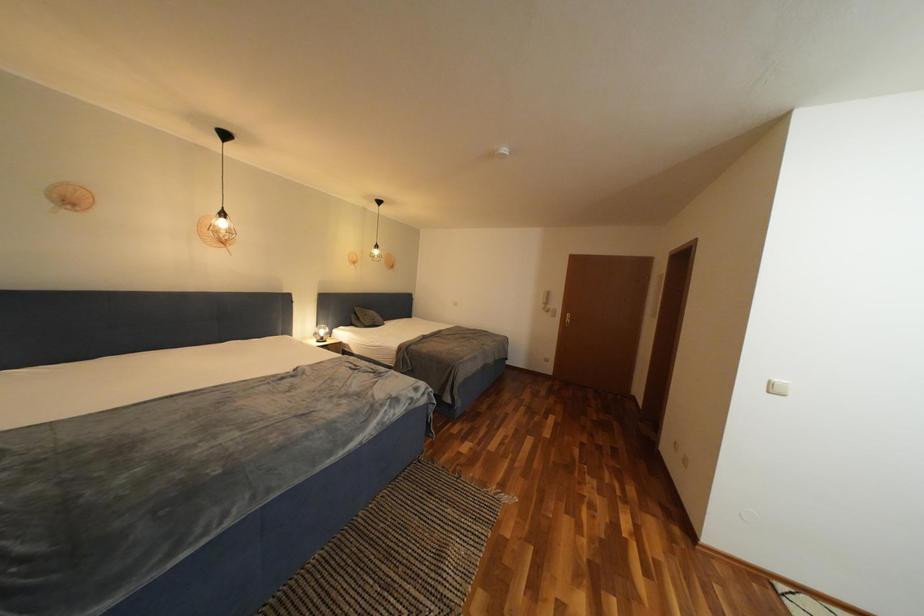
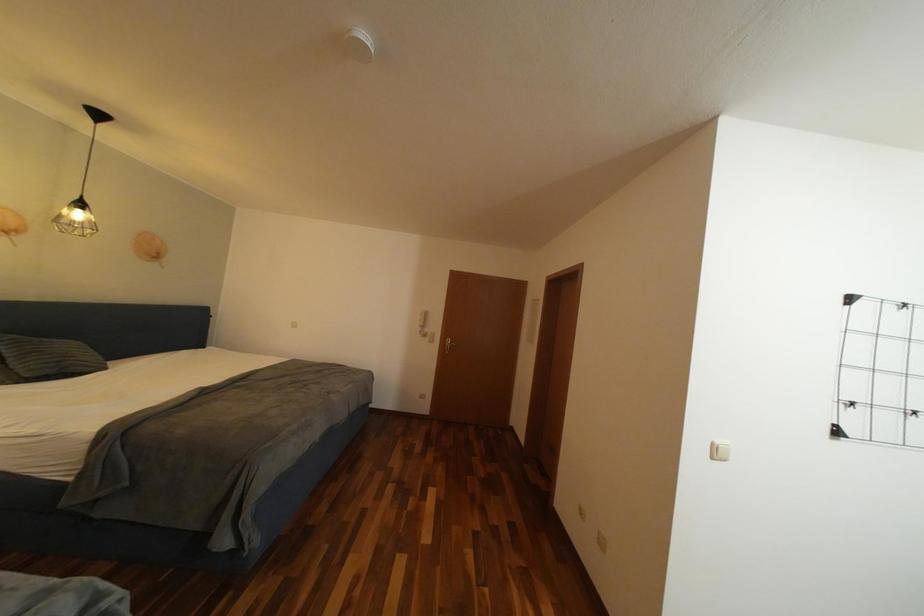
Question: Based on the continuous images, in which direction is the camera rotating? Reply with the corresponding letter.

Choices:
 (A) Left
 (B) Right
 (C) Up
 (D) Down

Answer: (B)